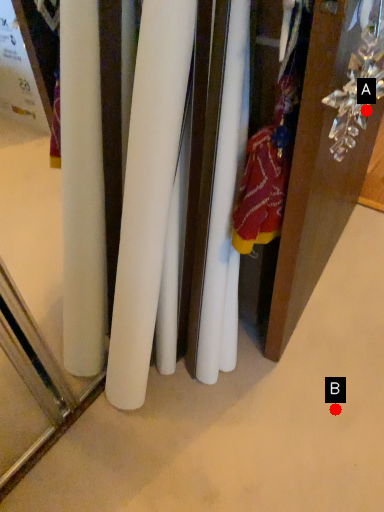
Question: Two points are circled on the image, labeled by A and B beside each circle. Which of the following is the closest to the observer?

Choices:
 (A) A is closer
 (B) B is closer

Answer: (A)